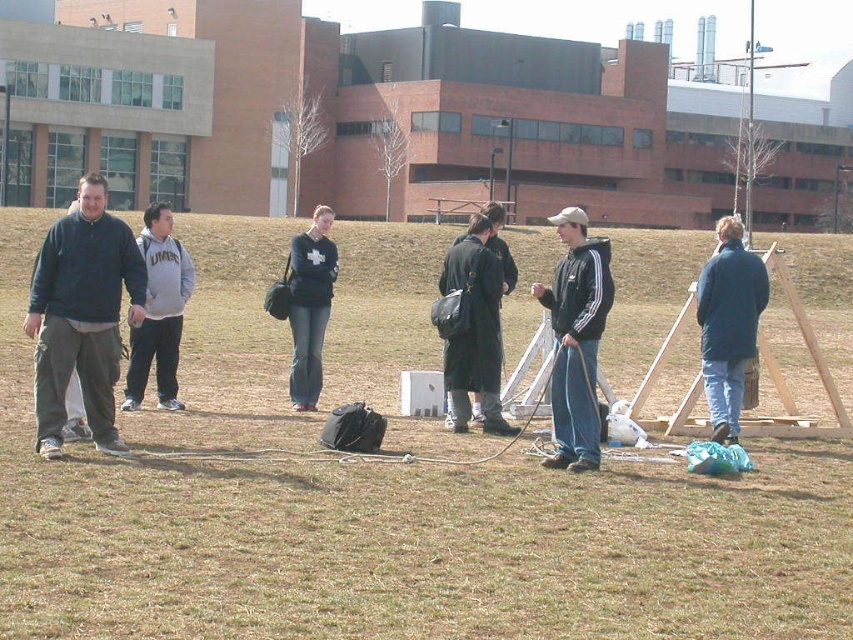
Does dark blue jacket at center have a greater height compared to dark gray coat at center?

Indeed, dark blue jacket at center has a greater height compared to dark gray coat at center.

Describe the element at coordinates (576, 339) in the screenshot. The width and height of the screenshot is (853, 640). I see `dark blue jacket at center` at that location.

Find the location of a particular element. dark blue jacket at center is located at coordinates (576, 339).

Based on the photo, who is taller, dark blue fleece at left or dark gray coat at center?

Standing taller between the two is dark blue fleece at left.

Does dark blue fleece at left appear over dark gray coat at center?

Correct, dark blue fleece at left is located above dark gray coat at center.

Is point (138, 257) positioned before point (473, 240)?

That is True.

Where is `dark blue fleece at left`? The width and height of the screenshot is (853, 640). dark blue fleece at left is located at coordinates (82, 316).

Which is in front, point (535, 285) or point (149, 339)?

Point (535, 285) is more forward.

Who is lower down, dark blue jacket at center or gray fleece sweatshirt at left?

gray fleece sweatshirt at left is lower down.

Measure the distance between point [606,278] and camera.

Point [606,278] is 11.18 meters from camera.

Locate an element on the screen. Image resolution: width=853 pixels, height=640 pixels. dark blue jacket at center is located at coordinates (576, 339).